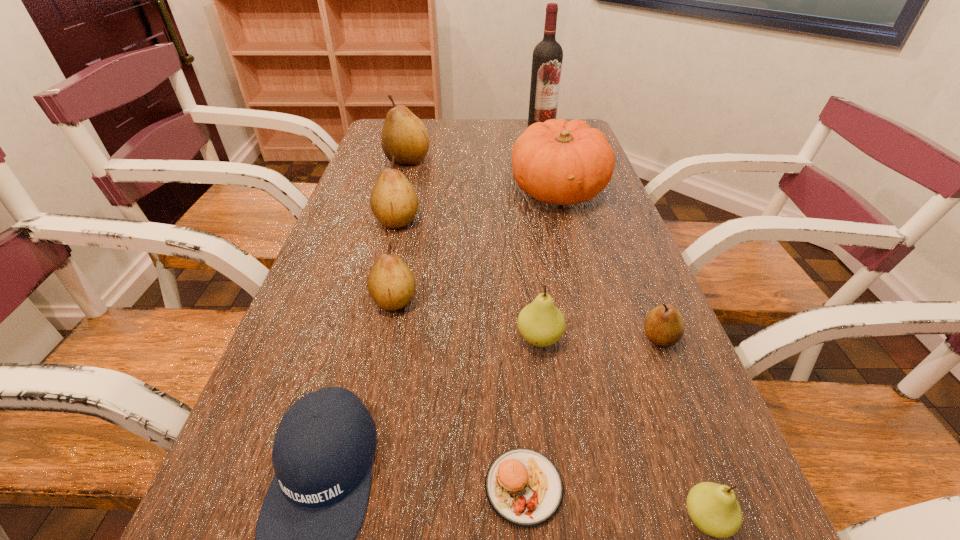
Locate an element on the screen. the sixth nearest object is located at coordinates (391, 284).

Locate an element on the screen. The height and width of the screenshot is (540, 960). the rightmost brown pear is located at coordinates (664, 326).

Where is `the nearest brown pear`? The image size is (960, 540). the nearest brown pear is located at coordinates (664, 326).

The image size is (960, 540). I want to click on the shortest object, so click(524, 487).

I want to click on free region located on the label of the tallest object, so click(x=548, y=153).

The image size is (960, 540). I want to click on vacant space located on the right of the tallest pear, so click(x=512, y=160).

At what (x,y) coordinates should I click in order to perform the action: click on vacant region located on the left of the orange pumpkin. Please return your answer as a coordinate pair (x, y). This screenshot has height=540, width=960. Looking at the image, I should click on (455, 191).

Find the location of a particular element. The width and height of the screenshot is (960, 540). vacant space located 0.110m on the back of the third nearest brown pear is located at coordinates (405, 187).

The height and width of the screenshot is (540, 960). Find the location of `free location located on the front of the left green pear`. free location located on the front of the left green pear is located at coordinates (547, 394).

Identify the location of vacant space situated on the back of the third biggest brown pear. The image size is (960, 540). (406, 241).